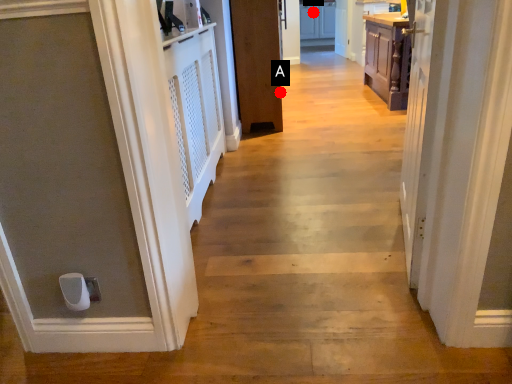
Question: Two points are circled on the image, labeled by A and B beside each circle. Among these points, which one is farthest from the camera?

Choices:
 (A) A is further
 (B) B is further

Answer: (B)